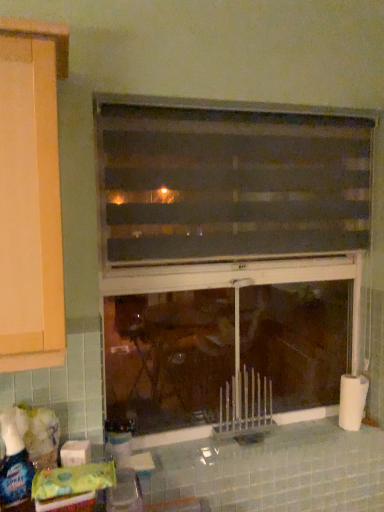
Where is `black matte window at center, the second window positioned from the top`? This screenshot has height=512, width=384. black matte window at center, the second window positioned from the top is located at coordinates (228, 256).

The height and width of the screenshot is (512, 384). What do you see at coordinates (75, 453) in the screenshot?
I see `white matte toilet paper at lower left, positioned as the second toilet paper in back-to-front order` at bounding box center [75, 453].

Find the location of a particular element. translucent plastic spray bottle at lower left, which is the first bottle in left-to-right order is located at coordinates (14, 469).

In the scene shown: From a real-world perspective, which object stands above the other?

white matte toilet paper at right, the 2th toilet paper in the left-to-right sequence.

Does translucent plastic bottle at lower left, acting as the 1th bottle starting from the right, have a lesser height compared to white matte toilet paper at right, the 2th toilet paper in the left-to-right sequence?

Correct, translucent plastic bottle at lower left, acting as the 1th bottle starting from the right, is not as tall as white matte toilet paper at right, the 2th toilet paper in the left-to-right sequence.

How distant is translucent plastic bottle at lower left, the 2th bottle viewed from the front, from white matte toilet paper at right, which ranks as the 1th toilet paper in right-to-left order?

The distance of translucent plastic bottle at lower left, the 2th bottle viewed from the front, from white matte toilet paper at right, which ranks as the 1th toilet paper in right-to-left order, is 36.14 inches.

Can you tell me how much translucent plastic bottle at lower left, acting as the 1th bottle starting from the right, and white matte toilet paper at right, which ranks as the 1th toilet paper in right-to-left order, differ in facing direction?

The facing directions of translucent plastic bottle at lower left, acting as the 1th bottle starting from the right, and white matte toilet paper at right, which ranks as the 1th toilet paper in right-to-left order, are 0.00147 degrees apart.

From the image's perspective, between white matte toilet paper at lower left, which ranks as the 2th toilet paper in right-to-left order, and translucent plastic spray bottle at lower left, which appears as the 2th bottle when viewed from the right, which one is located above?

translucent plastic spray bottle at lower left, which appears as the 2th bottle when viewed from the right, from the image's perspective.

From the picture: Who is taller, white matte toilet paper at lower left, marked as the 1th toilet paper in a left-to-right arrangement, or translucent plastic spray bottle at lower left, which appears as the 2th bottle when viewed from the right?

Standing taller between the two is translucent plastic spray bottle at lower left, which appears as the 2th bottle when viewed from the right.

From the translucent plastic spray bottle at lower left, the first bottle in the front-to-back sequence, count 1st toilet paper to the right and point to it. Please provide its 2D coordinates.

[(75, 453)]

Between white matte toilet paper at lower left, which ranks as the 2th toilet paper in right-to-left order, and translucent plastic spray bottle at lower left, which is the first bottle in left-to-right order, which one appears on the right side from the viewer's perspective?

From the viewer's perspective, white matte toilet paper at lower left, which ranks as the 2th toilet paper in right-to-left order, appears more on the right side.

Is white matte toilet paper at lower left, which ranks as the 2th toilet paper in right-to-left order, located outside translucent plastic window at center, acting as the second window starting from the bottom?

That's correct, white matte toilet paper at lower left, which ranks as the 2th toilet paper in right-to-left order, is outside of translucent plastic window at center, acting as the second window starting from the bottom.

From the image's perspective, is white matte toilet paper at lower left, which ranks as the 2th toilet paper in right-to-left order, above or below translucent plastic window at center, which is counted as the first window, starting from the top?

white matte toilet paper at lower left, which ranks as the 2th toilet paper in right-to-left order, is situated lower than translucent plastic window at center, which is counted as the first window, starting from the top, in the image.

Looking at the image, does white matte toilet paper at lower left, marked as the 1th toilet paper in a left-to-right arrangement, seem bigger or smaller compared to translucent plastic window at center, which is counted as the first window, starting from the top?

Considering their sizes, white matte toilet paper at lower left, marked as the 1th toilet paper in a left-to-right arrangement, takes up less space than translucent plastic window at center, which is counted as the first window, starting from the top.

How much distance is there between white matte toilet paper at lower left, which ranks as the 2th toilet paper in right-to-left order, and translucent plastic window at center, acting as the second window starting from the bottom?

A distance of 3.44 feet exists between white matte toilet paper at lower left, which ranks as the 2th toilet paper in right-to-left order, and translucent plastic window at center, acting as the second window starting from the bottom.

Does translucent plastic window at center, acting as the second window starting from the bottom, have a lesser height compared to white matte toilet paper at lower left, positioned as the second toilet paper in back-to-front order?

No, translucent plastic window at center, acting as the second window starting from the bottom, is not shorter than white matte toilet paper at lower left, positioned as the second toilet paper in back-to-front order.

Does translucent plastic window at center, acting as the second window starting from the bottom, contain white matte toilet paper at lower left, positioned as the 1th toilet paper in front-to-back order?

No, white matte toilet paper at lower left, positioned as the 1th toilet paper in front-to-back order, is located outside of translucent plastic window at center, acting as the second window starting from the bottom.

Is translucent plastic window at center, which is counted as the first window, starting from the top, oriented towards white matte toilet paper at lower left, positioned as the second toilet paper in back-to-front order?

No.

From a real-world perspective, is translucent plastic window at center, which is counted as the first window, starting from the top, below white matte toilet paper at lower left, which ranks as the 2th toilet paper in right-to-left order?

No.

Considering the sizes of objects translucent plastic bottle at lower left, the first bottle viewed from the back, and black matte window at center, the second window positioned from the top, in the image provided, who is thinner, translucent plastic bottle at lower left, the first bottle viewed from the back, or black matte window at center, the second window positioned from the top,?

black matte window at center, the second window positioned from the top.

From the image's perspective, which is below, translucent plastic bottle at lower left, arranged as the second bottle when viewed from the left, or black matte window at center, the second window positioned from the top?

translucent plastic bottle at lower left, arranged as the second bottle when viewed from the left, from the image's perspective.

Identify the location of window that is the 1st one when counting forward from the translucent plastic bottle at lower left, the 2th bottle viewed from the front. (228, 256).

Considering the relative sizes of translucent plastic bottle at lower left, the first bottle viewed from the back, and black matte window at center, marked as the 1th window in a bottom-to-top arrangement, in the image provided, is translucent plastic bottle at lower left, the first bottle viewed from the back, bigger than black matte window at center, marked as the 1th window in a bottom-to-top arrangement,?

Incorrect, translucent plastic bottle at lower left, the first bottle viewed from the back, is not larger than black matte window at center, marked as the 1th window in a bottom-to-top arrangement.

How much distance is there between translucent plastic window at center, acting as the second window starting from the bottom, and black matte window at center, the second window positioned from the top?

translucent plastic window at center, acting as the second window starting from the bottom, and black matte window at center, the second window positioned from the top, are 10.30 inches apart from each other.

From a real-world perspective, is translucent plastic window at center, acting as the second window starting from the bottom, on black matte window at center, marked as the 1th window in a bottom-to-top arrangement?

Yes, from a real-world perspective, translucent plastic window at center, acting as the second window starting from the bottom, is on top of black matte window at center, marked as the 1th window in a bottom-to-top arrangement.

Is point (184, 175) more distant than point (192, 202)?

No, (184, 175) is closer to viewer.

Considering the positions of objects translucent plastic window at center, acting as the second window starting from the bottom, and black matte window at center, the second window positioned from the top, in the image provided, who is more to the left, translucent plastic window at center, acting as the second window starting from the bottom, or black matte window at center, the second window positioned from the top,?

From the viewer's perspective, black matte window at center, the second window positioned from the top, appears more on the left side.

Find the location of a particular element. the 2nd bottle below the translucent plastic window at center, acting as the second window starting from the bottom (from a real-world perspective) is located at coordinates (118, 437).

Considering the positions of objects translucent plastic window at center, which is counted as the first window, starting from the top, and translucent plastic bottle at lower left, the 2th bottle viewed from the front, in the image provided, who is behind, translucent plastic window at center, which is counted as the first window, starting from the top, or translucent plastic bottle at lower left, the 2th bottle viewed from the front,?

translucent plastic bottle at lower left, the 2th bottle viewed from the front.

Which object is thinner, translucent plastic window at center, acting as the second window starting from the bottom, or translucent plastic bottle at lower left, acting as the 1th bottle starting from the right?

translucent plastic window at center, acting as the second window starting from the bottom, is thinner.

Who is taller, translucent plastic window at center, acting as the second window starting from the bottom, or translucent plastic bottle at lower left, the first bottle viewed from the back?

Standing taller between the two is translucent plastic window at center, acting as the second window starting from the bottom.

This screenshot has height=512, width=384. Find the location of `toilet paper located on the right of translucent plastic bottle at lower left, acting as the 1th bottle starting from the right`. toilet paper located on the right of translucent plastic bottle at lower left, acting as the 1th bottle starting from the right is located at coordinates (352, 401).

The height and width of the screenshot is (512, 384). I want to click on bottle in front of the white matte toilet paper at lower left, positioned as the 1th toilet paper in front-to-back order, so click(14, 469).

From the image, which object appears to be nearer to translucent plastic window at center, which is counted as the first window, starting from the top, white matte toilet paper at lower left, which ranks as the 2th toilet paper in right-to-left order, or translucent plastic spray bottle at lower left, which is the first bottle in left-to-right order?

white matte toilet paper at lower left, which ranks as the 2th toilet paper in right-to-left order, lies closer to translucent plastic window at center, which is counted as the first window, starting from the top, than the other object.

Based on their spatial positions, is translucent plastic window at center, which is counted as the first window, starting from the top, or white matte toilet paper at right, which ranks as the 1th toilet paper in right-to-left order, further from translucent plastic spray bottle at lower left, which appears as the 2th bottle when viewed from the right?

Based on the image, white matte toilet paper at right, which ranks as the 1th toilet paper in right-to-left order, appears to be further to translucent plastic spray bottle at lower left, which appears as the 2th bottle when viewed from the right.

From the image, which object appears to be farther from white matte toilet paper at right, which is counted as the 2th toilet paper, starting from the front, translucent plastic bottle at lower left, acting as the 1th bottle starting from the right, or white matte toilet paper at lower left, positioned as the 1th toilet paper in front-to-back order?

Answer: Based on the image, white matte toilet paper at lower left, positioned as the 1th toilet paper in front-to-back order, appears to be further to white matte toilet paper at right, which is counted as the 2th toilet paper, starting from the front.

Based on their spatial positions, is translucent plastic bottle at lower left, the first bottle viewed from the back, or translucent plastic window at center, acting as the second window starting from the bottom, closer to black matte window at center, marked as the 1th window in a bottom-to-top arrangement?

Among the two, translucent plastic window at center, acting as the second window starting from the bottom, is located nearer to black matte window at center, marked as the 1th window in a bottom-to-top arrangement.

Which object lies nearer to the anchor point translucent plastic window at center, which is counted as the first window, starting from the top, translucent plastic spray bottle at lower left, which is counted as the second bottle, starting from the back, or translucent plastic bottle at lower left, acting as the 1th bottle starting from the right?

translucent plastic bottle at lower left, acting as the 1th bottle starting from the right.

Based on their spatial positions, is white matte toilet paper at lower left, positioned as the second toilet paper in back-to-front order, or translucent plastic window at center, which is counted as the first window, starting from the top, further from translucent plastic bottle at lower left, acting as the 1th bottle starting from the right?

translucent plastic window at center, which is counted as the first window, starting from the top, is further to translucent plastic bottle at lower left, acting as the 1th bottle starting from the right.

From the image, which object appears to be farther from white matte toilet paper at lower left, which ranks as the 2th toilet paper in right-to-left order, translucent plastic spray bottle at lower left, which is the first bottle in left-to-right order, or translucent plastic window at center, which is counted as the first window, starting from the top?

The object further to white matte toilet paper at lower left, which ranks as the 2th toilet paper in right-to-left order, is translucent plastic window at center, which is counted as the first window, starting from the top.

Looking at the image, which one is located further to black matte window at center, the second window positioned from the top, translucent plastic window at center, acting as the second window starting from the bottom, or white matte toilet paper at lower left, which ranks as the 2th toilet paper in right-to-left order?

The object further to black matte window at center, the second window positioned from the top, is white matte toilet paper at lower left, which ranks as the 2th toilet paper in right-to-left order.

Locate an element on the screen. window between translucent plastic window at center, acting as the second window starting from the bottom, and white matte toilet paper at lower left, marked as the 1th toilet paper in a left-to-right arrangement, vertically is located at coordinates (228, 256).

The width and height of the screenshot is (384, 512). Find the location of `window between translucent plastic spray bottle at lower left, the first bottle in the front-to-back sequence, and translucent plastic window at center, which is counted as the first window, starting from the top, in the horizontal direction`. window between translucent plastic spray bottle at lower left, the first bottle in the front-to-back sequence, and translucent plastic window at center, which is counted as the first window, starting from the top, in the horizontal direction is located at coordinates (228, 256).

At what (x,y) coordinates should I click in order to perform the action: click on window that lies between translucent plastic window at center, acting as the second window starting from the bottom, and translucent plastic bottle at lower left, acting as the 1th bottle starting from the right, from top to bottom. Please return your answer as a coordinate pair (x, y). Looking at the image, I should click on (228, 256).

The height and width of the screenshot is (512, 384). Identify the location of toilet paper situated between translucent plastic spray bottle at lower left, which appears as the 2th bottle when viewed from the right, and white matte toilet paper at right, which ranks as the 1th toilet paper in right-to-left order, from left to right. (75, 453).